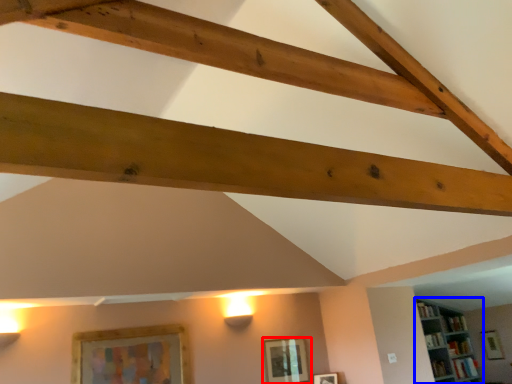
Question: Which object appears closest to the camera in this image, picture frame (highlighted by a red box) or shelf (highlighted by a blue box)?

Choices:
 (A) picture frame
 (B) shelf

Answer: (A)